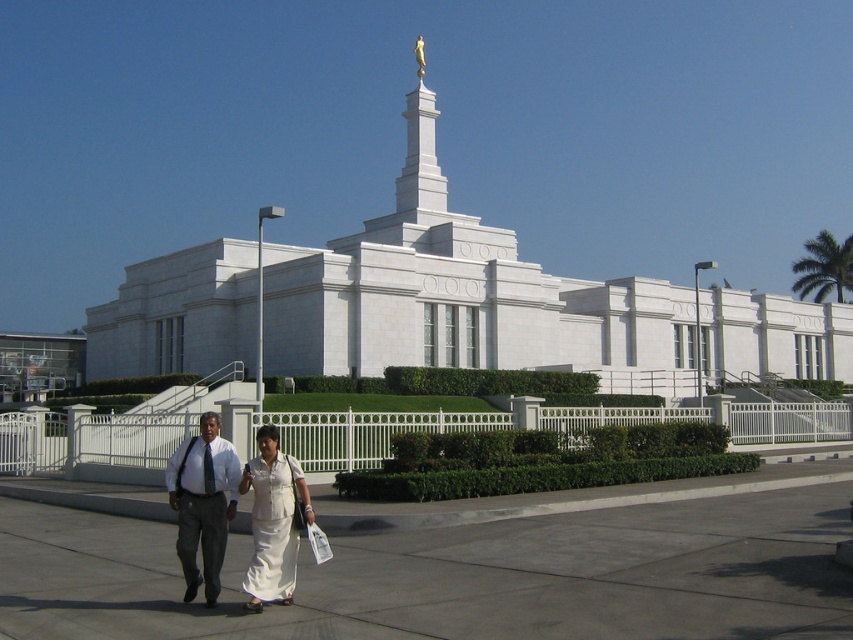
You are standing at the entrance of the temple and want to walk to the gray concrete pavement at center. Which direction should you walk to reach it?

The gray concrete pavement at center is located at point (454, 573), so you should walk forward towards the center of the temple area to reach it.